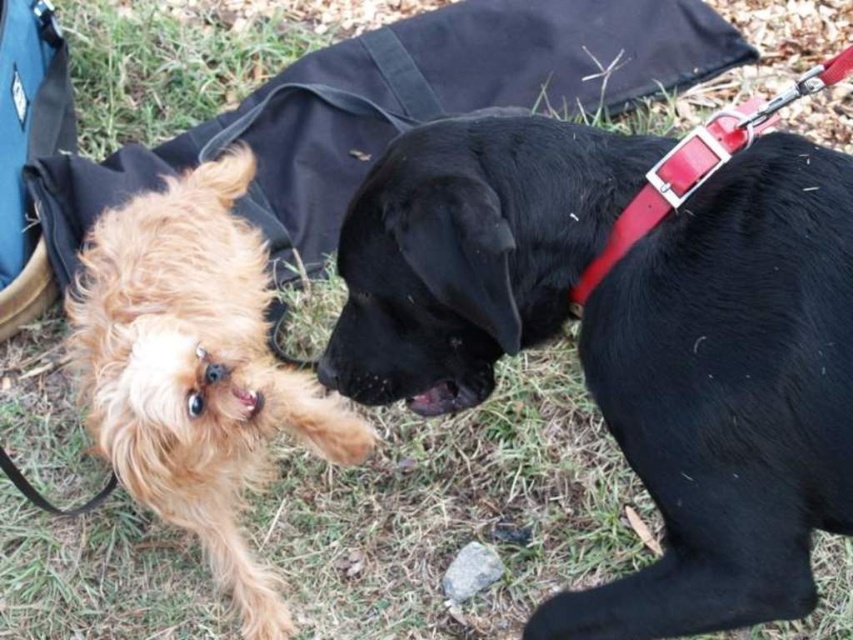
Does black smooth dog at center appear over golden fur dog at left?

Indeed, black smooth dog at center is positioned over golden fur dog at left.

Is point (662, 275) closer to viewer compared to point (276, 385)?

Yes, it is.

I want to click on black smooth dog at center, so click(x=727, y=396).